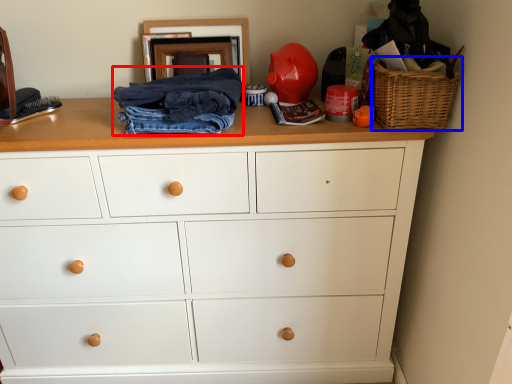
Question: Which object appears farthest to the camera in this image, clothing (highlighted by a red box) or basket (highlighted by a blue box)?

Choices:
 (A) clothing
 (B) basket

Answer: (A)